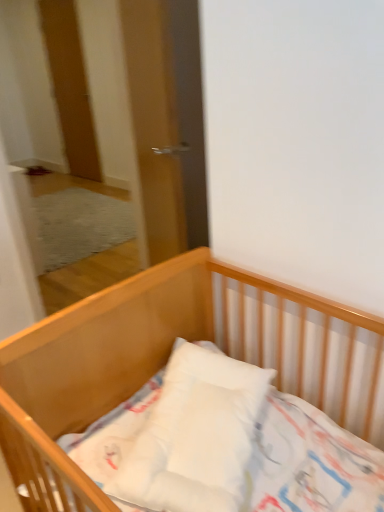
Question: Does wooden door at upper left have a lesser height compared to transparent glass door at center?

Choices:
 (A) yes
 (B) no

Answer: (B)

Question: Can you confirm if wooden door at upper left is thinner than transparent glass door at center?

Choices:
 (A) no
 (B) yes

Answer: (B)

Question: Are wooden door at upper left and transparent glass door at center located far from each other?

Choices:
 (A) yes
 (B) no

Answer: (A)

Question: Is wooden door at upper left facing towards transparent glass door at center?

Choices:
 (A) no
 (B) yes

Answer: (A)

Question: From the image's perspective, is wooden door at upper left over transparent glass door at center?

Choices:
 (A) no
 (B) yes

Answer: (B)

Question: From a real-world perspective, is transparent glass door at center above or below wooden door at upper left?

Choices:
 (A) below
 (B) above

Answer: (A)

Question: Is transparent glass door at center to the left or to the right of wooden door at upper left in the image?

Choices:
 (A) right
 (B) left

Answer: (A)

Question: Is point (168, 17) closer or farther from the camera than point (54, 24)?

Choices:
 (A) closer
 (B) farther

Answer: (A)

Question: Is transparent glass door at center inside or outside of wooden door at upper left?

Choices:
 (A) inside
 (B) outside

Answer: (B)

Question: Does point (54, 76) appear closer or farther from the camera than point (158, 285)?

Choices:
 (A) closer
 (B) farther

Answer: (B)

Question: From the image's perspective, is wooden door at upper left above or below wooden crib at center?

Choices:
 (A) below
 (B) above

Answer: (B)

Question: In terms of width, does wooden door at upper left look wider or thinner when compared to wooden crib at center?

Choices:
 (A) thin
 (B) wide

Answer: (A)

Question: From their relative heights in the image, would you say wooden door at upper left is taller or shorter than wooden crib at center?

Choices:
 (A) short
 (B) tall

Answer: (B)

Question: From their relative heights in the image, would you say wooden door at upper left is taller or shorter than transparent glass door at center?

Choices:
 (A) short
 (B) tall

Answer: (B)

Question: Is wooden door at upper left inside or outside of transparent glass door at center?

Choices:
 (A) outside
 (B) inside

Answer: (A)